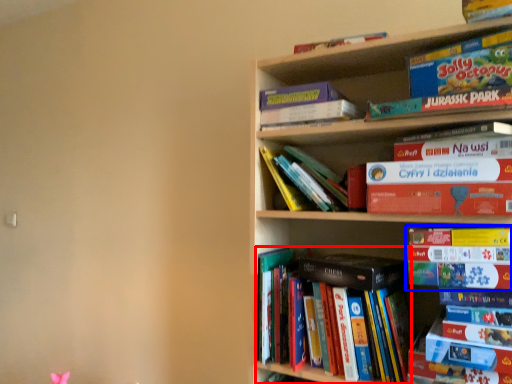
Question: Which point is further to the camera, book (highlighted by a red box) or book (highlighted by a blue box)?

Choices:
 (A) book
 (B) book

Answer: (A)